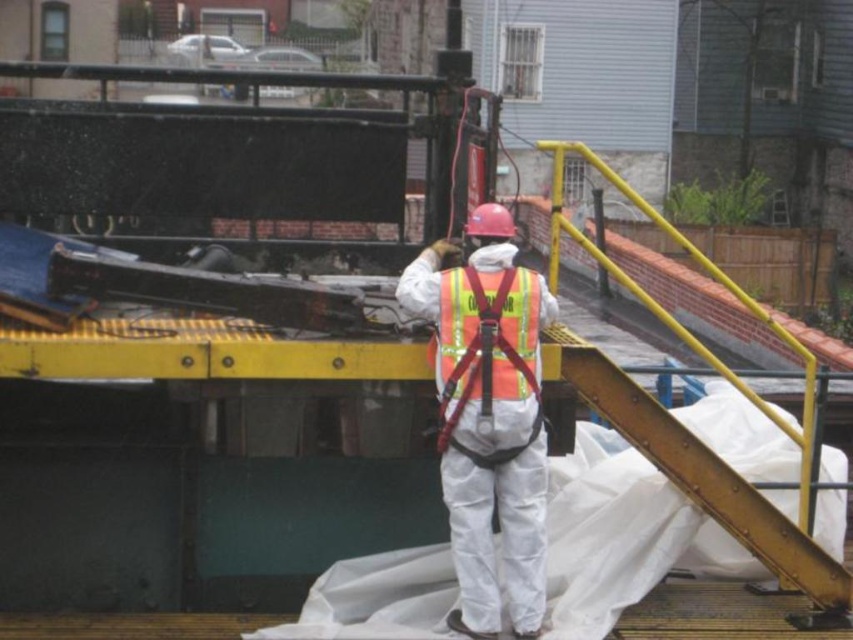
You are a safety inspector standing at the yellow metal platform. You notice two points marked on the platform. Which point is closer to you, point 1 at coordinates (525, 516) or point 2 at coordinates (524, 385)?

Point 2 at coordinates (524, 385) is closer to you because it is less further to the viewer than point 1 at coordinates (525, 516) according to the description.